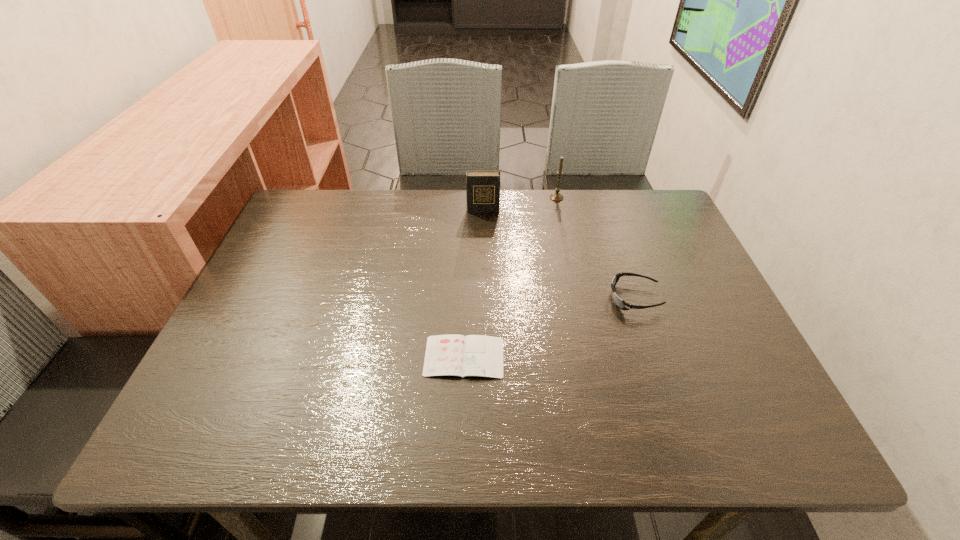
This screenshot has height=540, width=960. In the image, there is a desktop. Find the location of `vacant space at the right edge`. vacant space at the right edge is located at coordinates (751, 396).

Where is `free space at the far left corner`? Image resolution: width=960 pixels, height=540 pixels. free space at the far left corner is located at coordinates 323,216.

Where is `empty space that is in between the taller diary and the second shortest object`? empty space that is in between the taller diary and the second shortest object is located at coordinates (559, 254).

This screenshot has width=960, height=540. I want to click on vacant space in between the second object from right to left and the farther diary, so click(x=519, y=204).

The height and width of the screenshot is (540, 960). In order to click on free area in between the nearer diary and the second farthest object in this screenshot , I will do 473,284.

The height and width of the screenshot is (540, 960). Find the location of `free spot between the farthest object and the second shortest object`. free spot between the farthest object and the second shortest object is located at coordinates (595, 248).

Where is `free space between the shorter diary and the third object from left to right`? The image size is (960, 540). free space between the shorter diary and the third object from left to right is located at coordinates (511, 277).

I want to click on blank region between the third tallest object and the third object from left to right, so click(x=595, y=248).

At what (x,y) coordinates should I click in order to perform the action: click on blank region between the farthest object and the taller diary. Please return your answer as a coordinate pair (x, y). The width and height of the screenshot is (960, 540). Looking at the image, I should click on (519, 204).

Where is `free point between the second farthest object and the candle`? This screenshot has width=960, height=540. free point between the second farthest object and the candle is located at coordinates (519, 204).